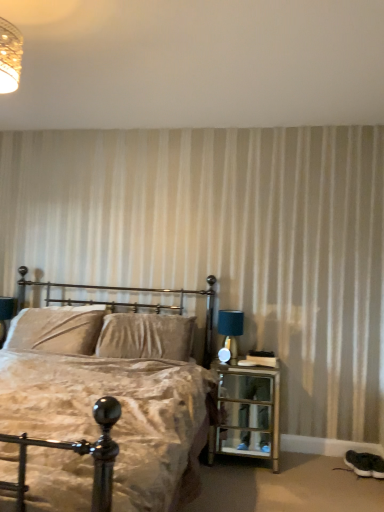
How much space does velvet beige pillow at center, marked as the 2th pillow in a right-to-left arrangement, occupy vertically?

It is 19.76 inches.

Measure the distance between point (116, 328) and camera.

Point (116, 328) and camera are 2.94 meters apart from each other.

Find the location of a particular element. The image size is (384, 512). velvet beige pillow at center, which is the second pillow from left to right is located at coordinates (145, 336).

This screenshot has height=512, width=384. What do you see at coordinates (230, 329) in the screenshot? I see `blue fabric table lamp at right` at bounding box center [230, 329].

Locate an element on the screen. This screenshot has height=512, width=384. white textured wall at upper center is located at coordinates (196, 64).

Describe the element at coordinates (247, 413) in the screenshot. I see `clear glass nightstand at right` at that location.

This screenshot has width=384, height=512. In order to click on velvet beige pillow at center, marked as the 2th pillow in a right-to-left arrangement in this screenshot , I will do `click(56, 329)`.

In the image, is velvet beige bed at center on the left side or the right side of blue fabric table lamp at right?

velvet beige bed at center is positioned on blue fabric table lamp at right's left side.

Between velvet beige bed at center and blue fabric table lamp at right, which one has larger width?

velvet beige bed at center is wider.

Which object is closer to the camera taking this photo, velvet beige bed at center or blue fabric table lamp at right?

velvet beige bed at center is closer to the camera.

From the picture: Is velvet beige bed at center facing towards blue fabric table lamp at right?

No, velvet beige bed at center is not turned towards blue fabric table lamp at right.

Choose the correct answer: Is clear glass nightstand at right inside white textured wall at upper center or outside it?

clear glass nightstand at right lies outside white textured wall at upper center.

Based on the photo, which object is thinner, clear glass nightstand at right or white textured wall at upper center?

Thinner between the two is clear glass nightstand at right.

Considering the relative positions of clear glass nightstand at right and white textured wall at upper center in the image provided, is clear glass nightstand at right behind white textured wall at upper center?

Yes, clear glass nightstand at right is further from the camera.

From a real-world perspective, between clear glass nightstand at right and white textured wall at upper center, who is vertically higher?

white textured wall at upper center.

Can white textured wall at upper center be found inside velvet beige pillow at center, which is the 1th pillow in right-to-left order?

No, white textured wall at upper center is located outside of velvet beige pillow at center, which is the 1th pillow in right-to-left order.

Can you tell me how much velvet beige pillow at center, which is the second pillow from left to right, and white textured wall at upper center differ in facing direction?

The facing directions of velvet beige pillow at center, which is the second pillow from left to right, and white textured wall at upper center are 0.151 degrees apart.

Can you confirm if velvet beige pillow at center, which is the 1th pillow in right-to-left order, is wider than white textured wall at upper center?

In fact, velvet beige pillow at center, which is the 1th pillow in right-to-left order, might be narrower than white textured wall at upper center.

Can you confirm if velvet beige pillow at center, which is the second pillow from left to right, is shorter than white textured wall at upper center?

Incorrect, the height of velvet beige pillow at center, which is the second pillow from left to right, does not fall short of that of white textured wall at upper center.

Between velvet beige pillow at center, the 1th pillow viewed from the left, and blue fabric table lamp at right, which one has larger width?

velvet beige pillow at center, the 1th pillow viewed from the left, is wider.

Does point (45, 337) come behind point (219, 316)?

No, it is in front of (219, 316).

Is velvet beige pillow at center, marked as the 2th pillow in a right-to-left arrangement, facing away from blue fabric table lamp at right?

velvet beige pillow at center, marked as the 2th pillow in a right-to-left arrangement, is not turned away from blue fabric table lamp at right.

Consider the image. Can we say velvet beige pillow at center, marked as the 2th pillow in a right-to-left arrangement, lies outside blue fabric table lamp at right?

That's correct, velvet beige pillow at center, marked as the 2th pillow in a right-to-left arrangement, is outside of blue fabric table lamp at right.

Does point (155, 329) lie in front of point (94, 334)?

Yes, it is.

Does velvet beige pillow at center, which is the 1th pillow in right-to-left order, appear on the left side of velvet beige pillow at center, the 1th pillow viewed from the left?

No, velvet beige pillow at center, which is the 1th pillow in right-to-left order, is not to the left of velvet beige pillow at center, the 1th pillow viewed from the left.

In the scene shown: Does velvet beige pillow at center, which is the second pillow from left to right, have a greater height compared to velvet beige pillow at center, marked as the 2th pillow in a right-to-left arrangement?

Yes, velvet beige pillow at center, which is the second pillow from left to right, is taller than velvet beige pillow at center, marked as the 2th pillow in a right-to-left arrangement.

Which of these two, velvet beige pillow at center, which is the second pillow from left to right, or velvet beige pillow at center, marked as the 2th pillow in a right-to-left arrangement, is thinner?

velvet beige pillow at center, which is the second pillow from left to right, is thinner.

Based on the photo, in the image, is blue fabric table lamp at right on the left side or the right side of velvet beige pillow at center, which is the 1th pillow in right-to-left order?

From the image, it's evident that blue fabric table lamp at right is to the right of velvet beige pillow at center, which is the 1th pillow in right-to-left order.

Consider the image. Who is smaller, blue fabric table lamp at right or velvet beige pillow at center, which is the second pillow from left to right?

blue fabric table lamp at right is smaller.

What's the angular difference between blue fabric table lamp at right and velvet beige pillow at center, which is the second pillow from left to right,'s facing directions?

The angular difference between blue fabric table lamp at right and velvet beige pillow at center, which is the second pillow from left to right, is 0.000188 degrees.

From a real-world perspective, is blue fabric table lamp at right located higher than velvet beige pillow at center, which is the 1th pillow in right-to-left order?

Yes.

Looking at the image, does velvet beige pillow at center, marked as the 2th pillow in a right-to-left arrangement, seem bigger or smaller compared to velvet beige bed at center?

In the image, velvet beige pillow at center, marked as the 2th pillow in a right-to-left arrangement, appears to be smaller than velvet beige bed at center.

From the image's perspective, between velvet beige pillow at center, the 1th pillow viewed from the left, and velvet beige bed at center, which one is located above?

velvet beige pillow at center, the 1th pillow viewed from the left, from the image's perspective.

Which is farther from the camera, (87, 350) or (127, 493)?

Positioned behind is point (87, 350).

You are a GUI agent. You are given a task and a screenshot of the screen. Output one action in this format:
    pyautogui.click(x=<x>, y=<y>)
    Task: Click on the table lamp above the velvet beige bed at center (from the image's perspective)
    Image resolution: width=384 pixels, height=512 pixels.
    Given the screenshot: What is the action you would take?
    pyautogui.click(x=230, y=329)

Identify the location of nightstand on the right side of white textured wall at upper center. This screenshot has height=512, width=384. (247, 413).

Considering their positions, is white textured wall at upper center positioned further to velvet beige pillow at center, which is the second pillow from left to right, than velvet beige bed at center?

white textured wall at upper center.

Considering their positions, is blue fabric table lamp at right positioned closer to velvet beige bed at center than white textured wall at upper center?

blue fabric table lamp at right lies closer to velvet beige bed at center than the other object.

Looking at the image, which one is located further to white textured wall at upper center, velvet beige pillow at center, which is the 1th pillow in right-to-left order, or velvet beige pillow at center, the 1th pillow viewed from the left?

velvet beige pillow at center, the 1th pillow viewed from the left.

Which object lies further to the anchor point velvet beige pillow at center, which is the 1th pillow in right-to-left order, blue fabric table lamp at right or velvet beige bed at center?

blue fabric table lamp at right lies further to velvet beige pillow at center, which is the 1th pillow in right-to-left order, than the other object.

Which object lies nearer to the anchor point clear glass nightstand at right, blue fabric table lamp at right or velvet beige pillow at center, marked as the 2th pillow in a right-to-left arrangement?

blue fabric table lamp at right is positioned closer to the anchor clear glass nightstand at right.

From the image, which object appears to be farther from blue fabric table lamp at right, velvet beige pillow at center, which is the second pillow from left to right, or clear glass nightstand at right?

velvet beige pillow at center, which is the second pillow from left to right, is positioned further to the anchor blue fabric table lamp at right.

Considering their positions, is velvet beige pillow at center, the 1th pillow viewed from the left, positioned further to velvet beige pillow at center, which is the second pillow from left to right, than white textured wall at upper center?

white textured wall at upper center is further to velvet beige pillow at center, which is the second pillow from left to right.

From the image, which object appears to be nearer to velvet beige pillow at center, the 1th pillow viewed from the left, velvet beige pillow at center, which is the 1th pillow in right-to-left order, or clear glass nightstand at right?

velvet beige pillow at center, which is the 1th pillow in right-to-left order, lies closer to velvet beige pillow at center, the 1th pillow viewed from the left, than the other object.

The height and width of the screenshot is (512, 384). Find the location of `table lamp between velvet beige pillow at center, the 1th pillow viewed from the left, and clear glass nightstand at right`. table lamp between velvet beige pillow at center, the 1th pillow viewed from the left, and clear glass nightstand at right is located at coordinates (230, 329).

Where is `table lamp between white textured wall at upper center and clear glass nightstand at right from top to bottom`? This screenshot has height=512, width=384. table lamp between white textured wall at upper center and clear glass nightstand at right from top to bottom is located at coordinates (230, 329).

Find the location of a particular element. nightstand between velvet beige bed at center and velvet beige pillow at center, which is the 1th pillow in right-to-left order, along the z-axis is located at coordinates (247, 413).

You are a GUI agent. You are given a task and a screenshot of the screen. Output one action in this format:
    pyautogui.click(x=<x>, y=<y>)
    Task: Click on the pillow between velvet beige pillow at center, the 1th pillow viewed from the left, and clear glass nightstand at right
    The image size is (384, 512).
    Given the screenshot: What is the action you would take?
    pyautogui.click(x=145, y=336)